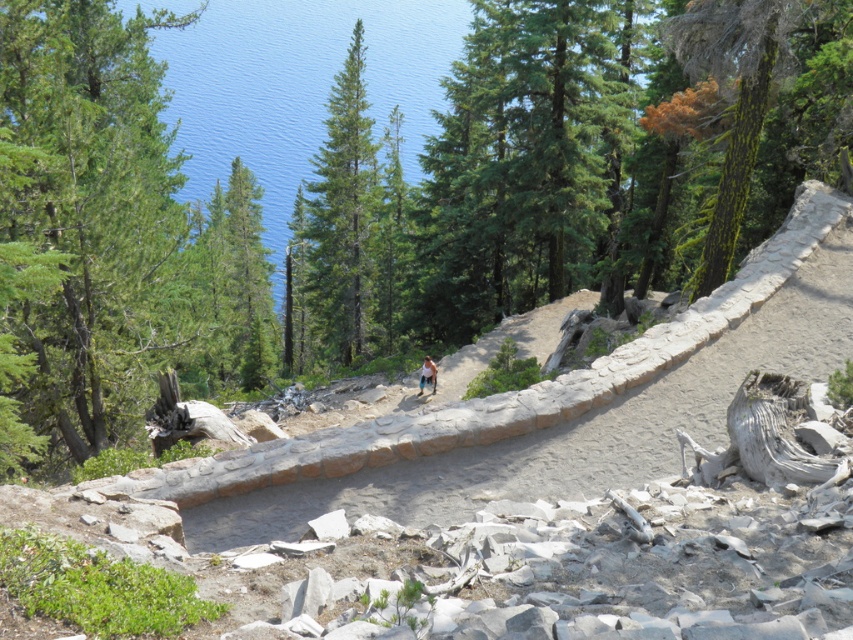
Is green textured tree at upper left further to the viewer compared to light blue denim shorts at center?

No.

Is point (144, 400) positioned in front of point (430, 365)?

That is True.

I want to click on green textured tree at upper left, so click(82, 224).

Who is positioned more to the right, green matte tree at center or light blue denim shorts at center?

light blue denim shorts at center is more to the right.

Which is in front, point (335, 333) or point (434, 368)?

Point (434, 368)

Describe the element at coordinates (339, 220) in the screenshot. I see `green matte tree at center` at that location.

Find the location of a particular element. green matte tree at center is located at coordinates (339, 220).

Does green textured tree at upper left appear over green matte tree at center?

No.

Is point (1, 122) closer to viewer compared to point (351, 198)?

Yes.

The height and width of the screenshot is (640, 853). In order to click on green textured tree at upper left in this screenshot , I will do `click(82, 224)`.